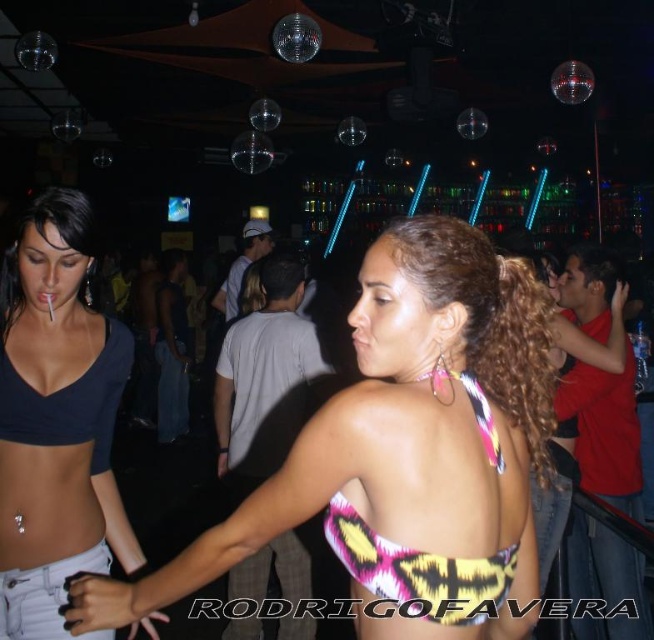
You are a photographer at the event and want to capture both the matte black top at left and the yellow and pink patterned bikini top at back in a single photo. Can you see both items clearly in your camera frame?

The matte black top at left is positioned over the yellow and pink patterned bikini top at back, so the matte black top at left may block the view of the yellow and pink patterned bikini top at back in the photo.

You are a fashion designer analyzing the nightclub scene. You notice the printed fabric bikini top at center and the matte black top at left. Which top has a larger size?

The printed fabric bikini top at center has a larger size compared to the matte black top at left.

You are standing in the nightclub and want to know how far the point at coordinates point (460, 442) is from you. Can you determine the distance?

The distance of point (460, 442) from camera is 3.47 feet.